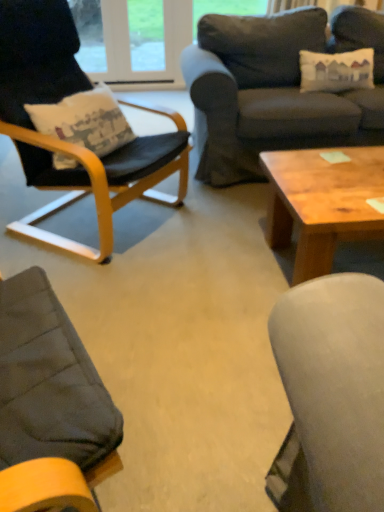
Where is `free location to the left of wooden coffee table at center`? This screenshot has width=384, height=512. free location to the left of wooden coffee table at center is located at coordinates point(205,277).